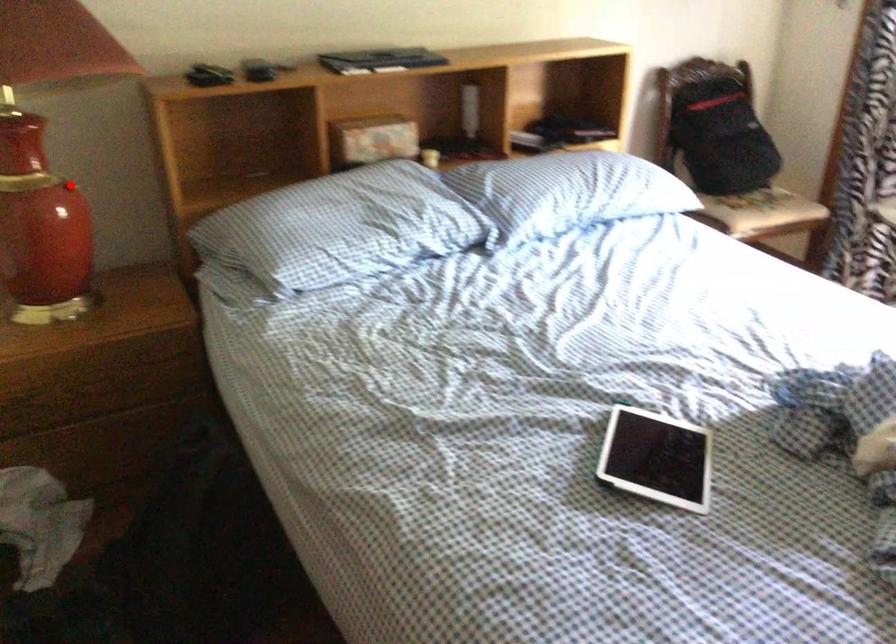
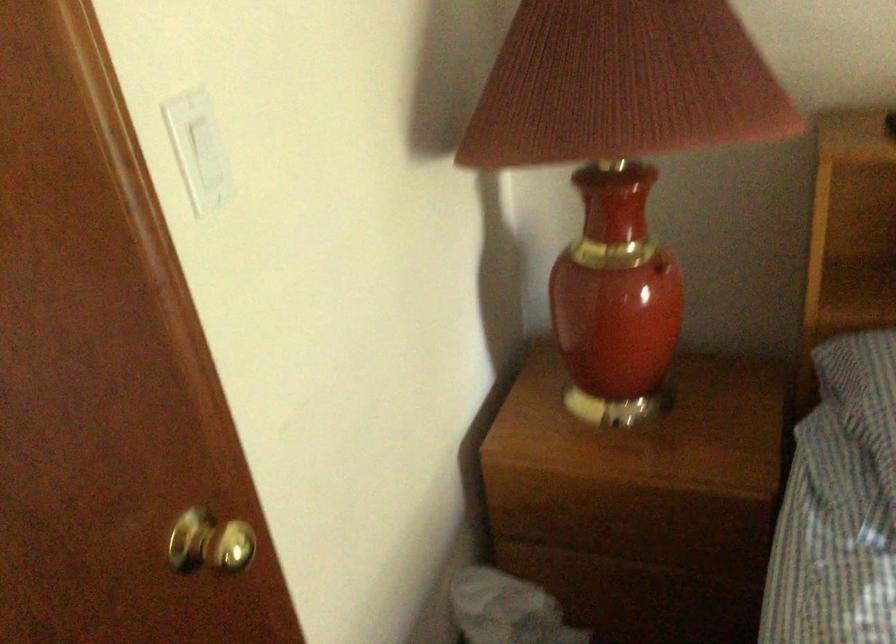
Where in the second image is the point corresponding to the highlighted location from the first image?

(661, 267)